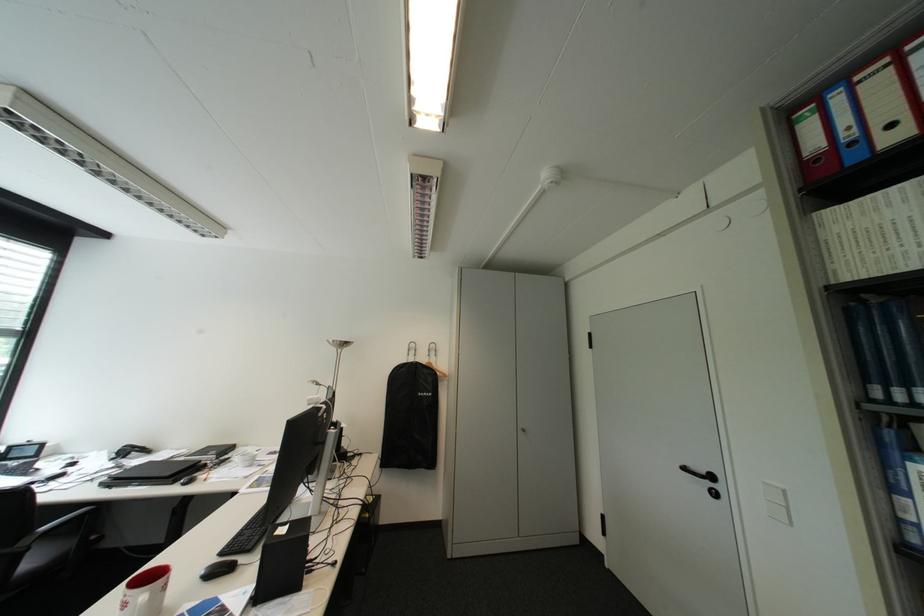
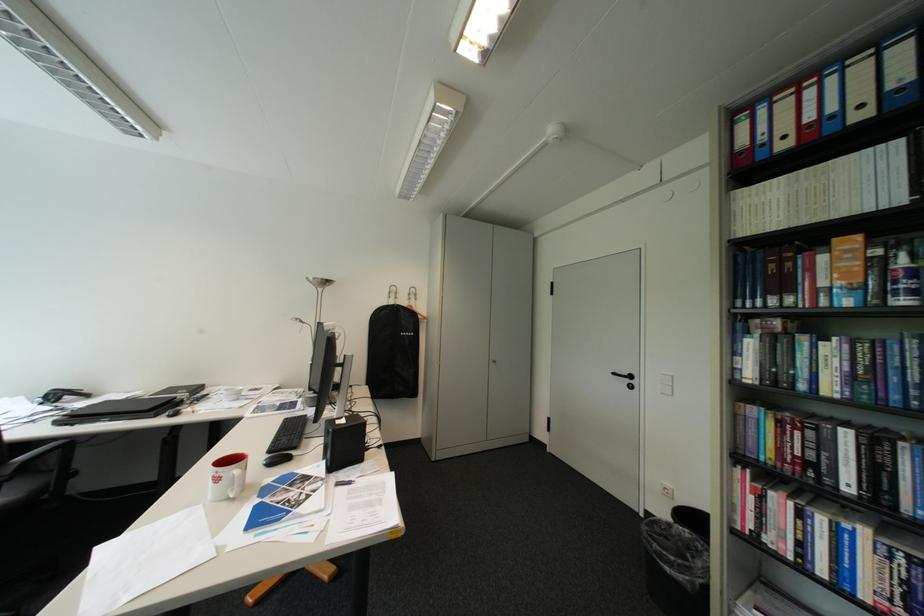
Question: The camera is either moving clockwise (left) or counter-clockwise (right) around the object. The first image is from the beginning of the video and the second image is from the end. Is the camera moving left or right when shooting the video?

Choices:
 (A) Left
 (B) Right

Answer: (A)